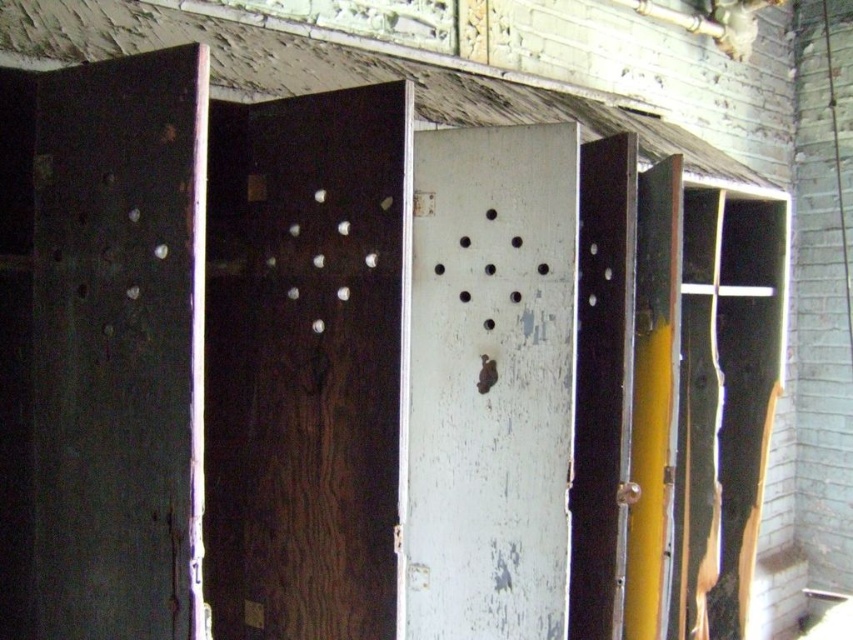
You are an inspector assessing the structural integrity of the abandoned building. You notice the dark wood door at center and the white peeling paint at center. Which of these two features is taller?

The white peeling paint at center is taller than the dark wood door at center.

You are standing in the abandoned building and want to reach the point marked at coordinates (236,339). If your current position is 1.61 meters away from that point, can you walk directly to it without any obstacles?

The point at (236,339) is 1.61 meters away from you. Since there are no obstacles mentioned in the scene description, you can walk directly to it.

Consider the image. You are standing in the abandoned building and notice two points marked on the wall. The first point is at coordinates point (312, 298) and the second is at point (437, 138). Which point is closer to you?

Point (312, 298) is closer to the camera than point (437, 138).